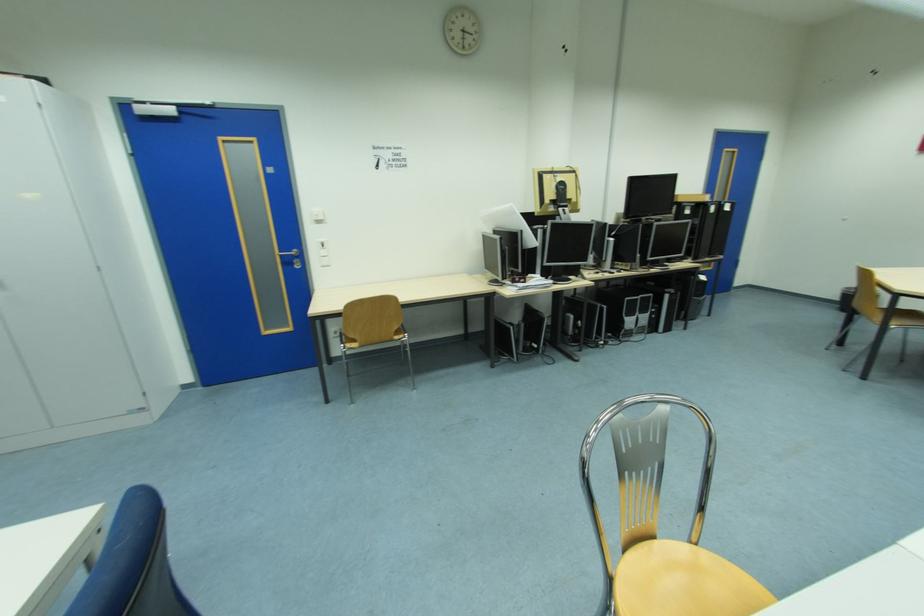
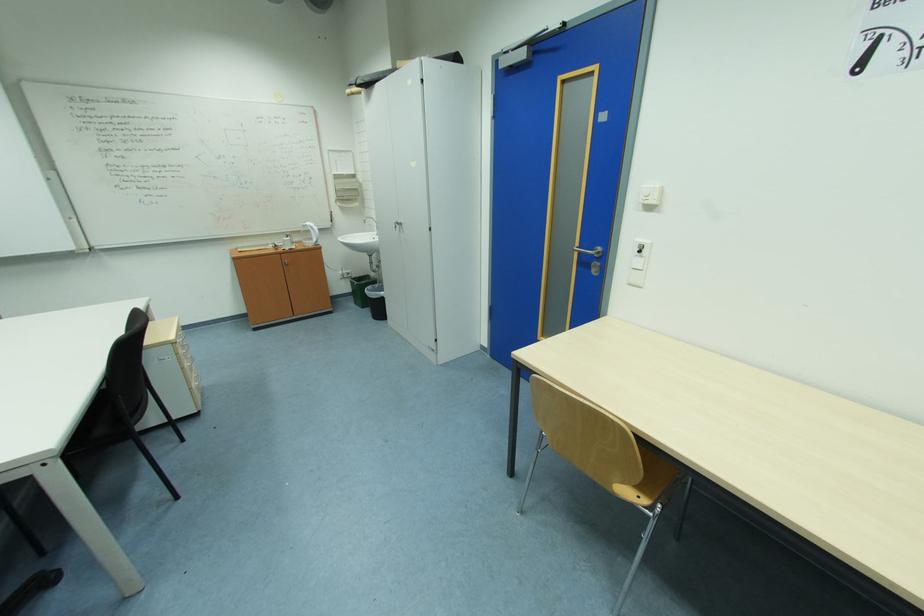
Find the pixel in the second image that matches point 287,257 in the first image.

(587, 253)